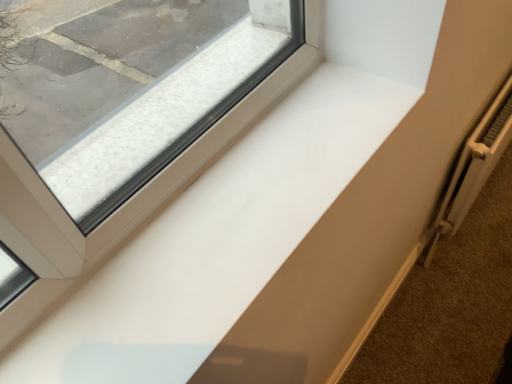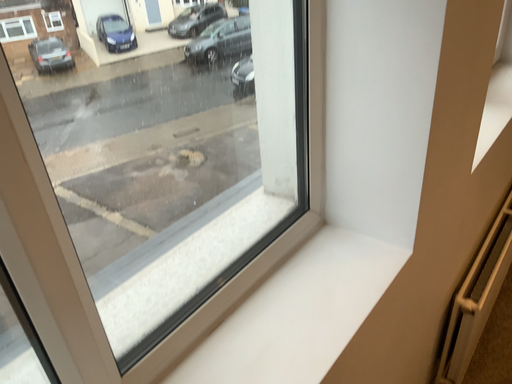
Question: How did the camera likely rotate when shooting the video?

Choices:
 (A) rotated upward
 (B) rotated downward

Answer: (A)